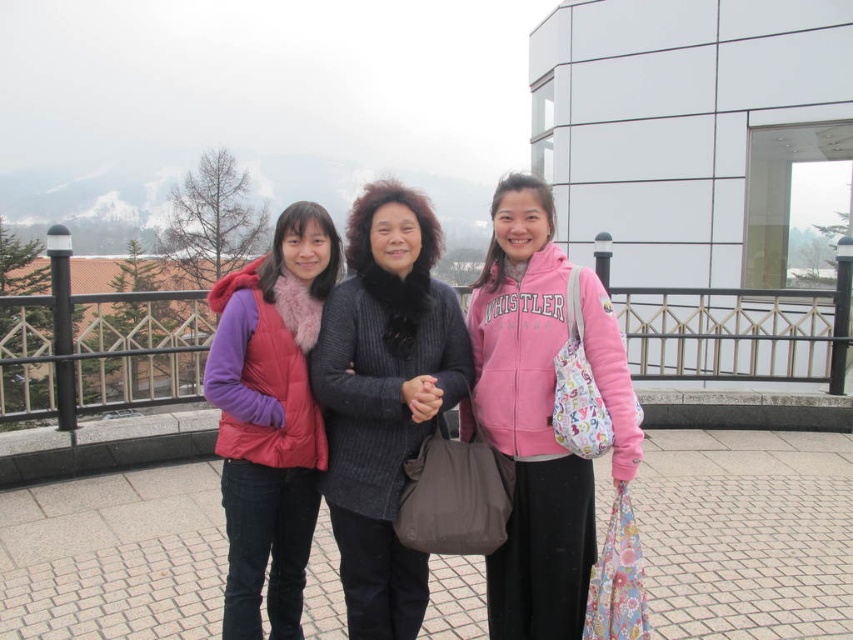
You are standing on a balcony and see two pink items of clothing. The pink fleece jacket at center and the matte pink vest at left. Which one is positioned to the right of the other?

The pink fleece jacket at center is positioned to the right of the matte pink vest at left.

You are trying to decide which layer to remove first to adjust your outfit. Based on the image description, which clothing item is on top of the other between the knitted gray sweater at center and the matte pink vest at left?

The knitted gray sweater at center is positioned over the matte pink vest at left, so you should remove the knitted gray sweater at center first.